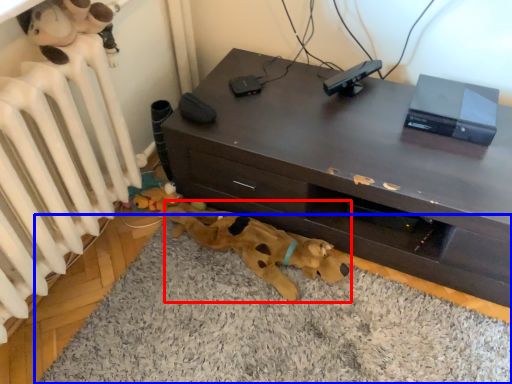
Question: Which object appears farthest to the camera in this image, toy (highlighted by a red box) or dog bed (highlighted by a blue box)?

Choices:
 (A) toy
 (B) dog bed

Answer: (A)